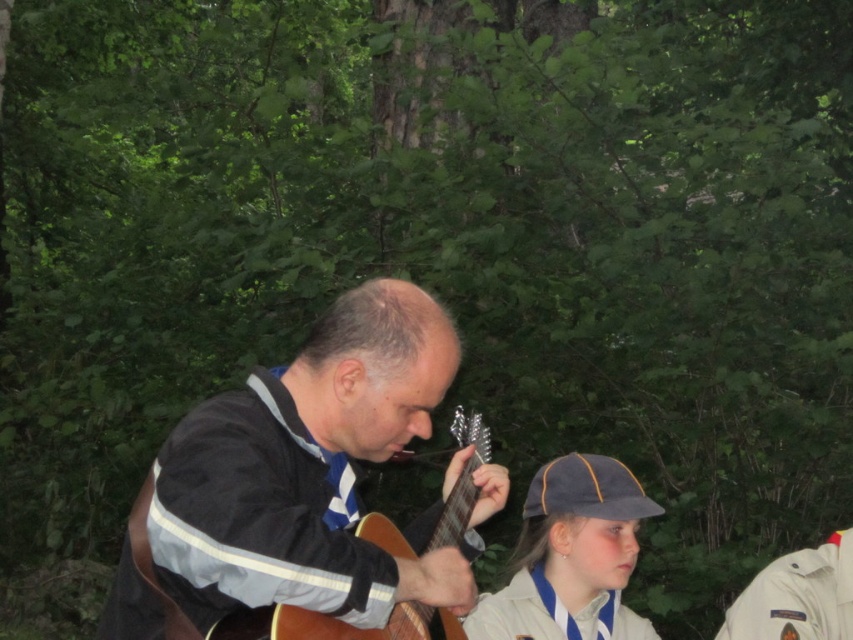
Based on the photo, can you confirm if gray fabric cap at lower right is positioned below white fabric uniform at right?

No, gray fabric cap at lower right is not below white fabric uniform at right.

Between gray fabric cap at lower right and white fabric uniform at right, which one has less height?

white fabric uniform at right

Is point (618, 532) positioned in front of point (843, 566)?

That is True.

This screenshot has height=640, width=853. What are the coordinates of `gray fabric cap at lower right` in the screenshot? It's located at (572, 556).

Does gray fabric cap at lower right have a greater width compared to wooden acoustic guitar at center?

Yes.

Is point (595, 513) behind point (474, 465)?

That is True.

Where is `gray fabric cap at lower right`? The height and width of the screenshot is (640, 853). gray fabric cap at lower right is located at coordinates (572, 556).

Which is behind, point (619, 625) or point (654, 637)?

Point (654, 637)

Who is positioned more to the right, gray fabric cap at lower right or white fabric uniform at lower center?

gray fabric cap at lower right

Which is in front, point (596, 481) or point (547, 588)?

Point (596, 481) is in front.

At what (x,y) coordinates should I click in order to perform the action: click on gray fabric cap at lower right. Please return your answer as a coordinate pair (x, y). The height and width of the screenshot is (640, 853). Looking at the image, I should click on (572, 556).